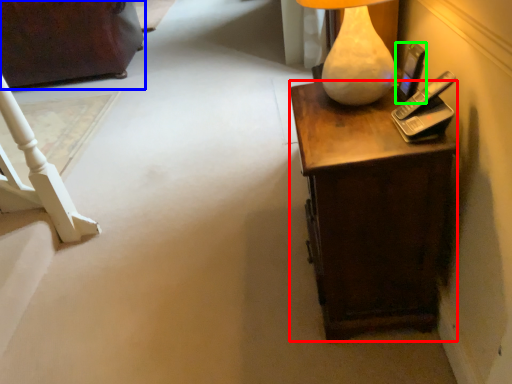
Question: Estimate the real-world distances between objects in this image. Which object is farther from desk (highlighted by a red box), furniture (highlighted by a blue box) or mobile phone (highlighted by a green box)?

Choices:
 (A) furniture
 (B) mobile phone

Answer: (A)